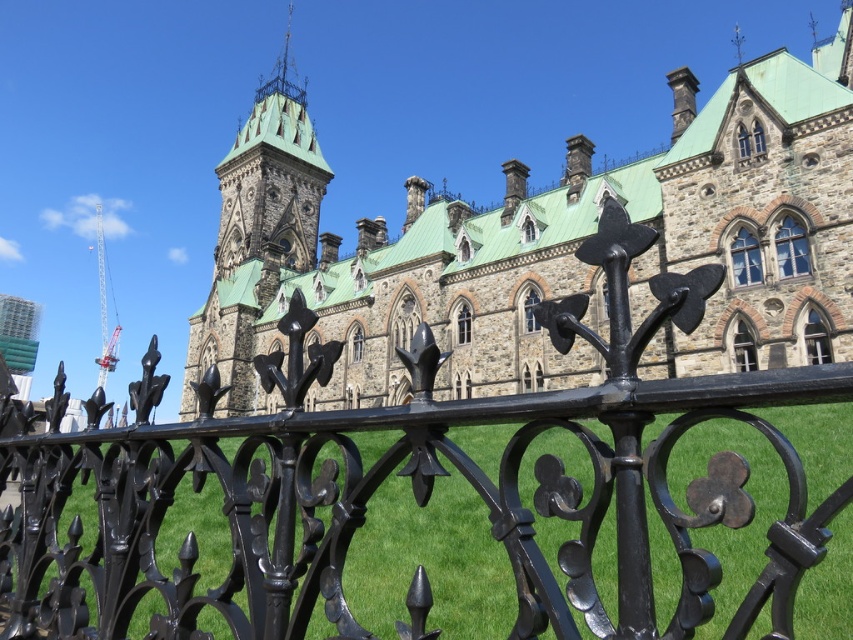
You are standing outside the stone church at center and want to enter through the main entrance. Is the black wrought iron fence at center blocking your path to the entrance?

The black wrought iron fence at center is in front of the stone church at center, so it is blocking your path to the entrance.

You are standing in front of the grand stone building and want to touch both the black wrought iron fence at center and the green stone tower at upper center. Which one can you reach first without moving your position?

The black wrought iron fence at center is closer to the viewer than the green stone tower at upper center, so you can reach it first without moving.